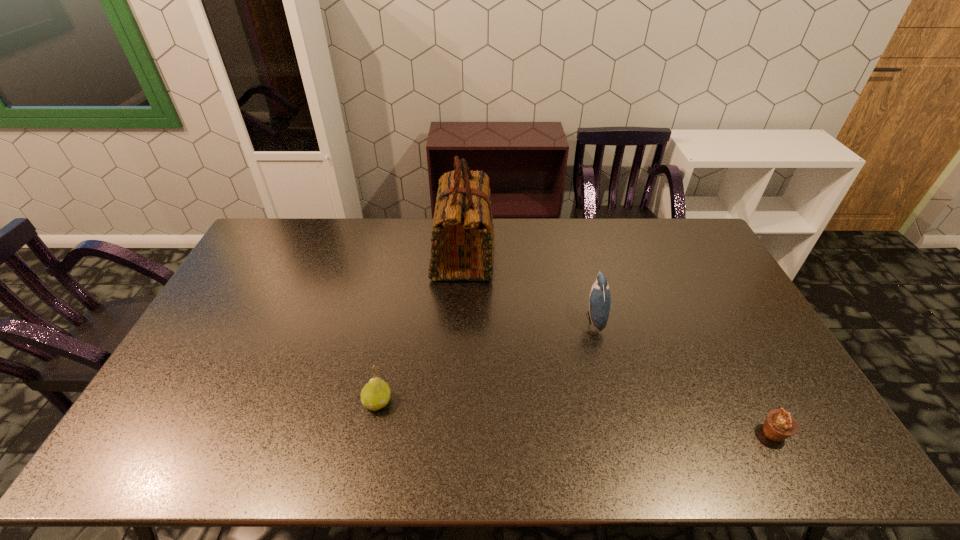
Find the location of a particular element. The height and width of the screenshot is (540, 960). free space located at the tip of the third shortest object's beak is located at coordinates (495, 319).

Image resolution: width=960 pixels, height=540 pixels. Identify the location of vacant space located 0.400m at the tip of the third shortest object's beak. (457, 319).

At what (x,y) coordinates should I click in order to perform the action: click on free region located on the right of the third farthest object. Please return your answer as a coordinate pair (x, y). Looking at the image, I should click on 434,402.

This screenshot has width=960, height=540. In order to click on vacant space situated 0.150m on the left of the nearest object in this screenshot , I will do `click(699, 434)`.

This screenshot has width=960, height=540. I want to click on object present at the far edge, so click(x=462, y=248).

At what (x,y) coordinates should I click in order to perform the action: click on object that is at the near edge. Please return your answer as a coordinate pair (x, y). The width and height of the screenshot is (960, 540). Looking at the image, I should click on (x=779, y=425).

The height and width of the screenshot is (540, 960). Find the location of `object at the right edge`. object at the right edge is located at coordinates (779, 425).

In order to click on object that is at the near right corner in this screenshot , I will do `click(779, 425)`.

In the image, there is a desktop. Identify the location of vacant space at the far edge. Image resolution: width=960 pixels, height=540 pixels. (656, 252).

The height and width of the screenshot is (540, 960). In order to click on vacant region at the near edge in this screenshot , I will do `click(731, 436)`.